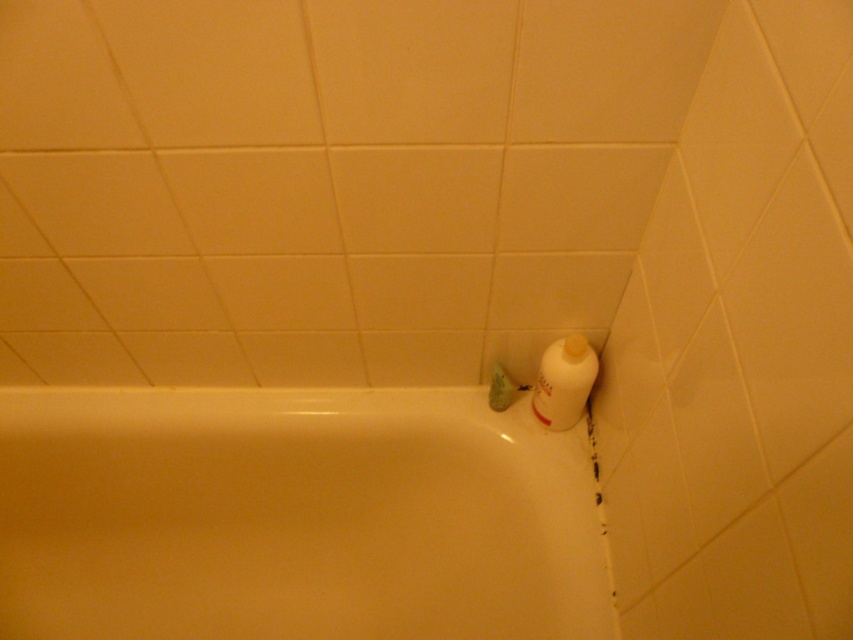
Question: Which object is the closest to the white glossy bathtub at lower left?

Choices:
 (A) white plastic bottle at upper right
 (B) green matte soap at corner

Answer: (A)

Question: Is white glossy bathtub at lower left smaller than green matte soap at corner?

Choices:
 (A) no
 (B) yes

Answer: (A)

Question: Which of the following is the farthest from the observer?

Choices:
 (A) (583, 368)
 (B) (497, 392)
 (C) (421, 588)

Answer: (C)

Question: Which of the following is the farthest from the observer?

Choices:
 (A) (564, 371)
 (B) (506, 372)
 (C) (236, 538)

Answer: (C)

Question: Can you confirm if white glossy bathtub at lower left is positioned to the right of white plastic bottle at upper right?

Choices:
 (A) yes
 (B) no

Answer: (B)

Question: Considering the relative positions of white plastic bottle at upper right and green matte soap at corner in the image provided, where is white plastic bottle at upper right located with respect to green matte soap at corner?

Choices:
 (A) right
 (B) left

Answer: (A)